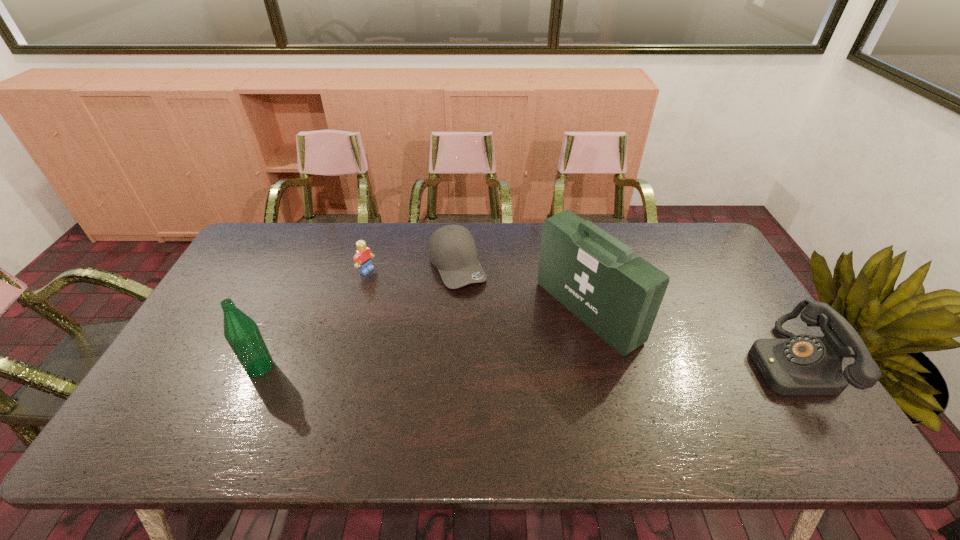
Locate an element on the screen. The height and width of the screenshot is (540, 960). bottle is located at coordinates [241, 332].

Where is `the fourth shortest object`? the fourth shortest object is located at coordinates (241, 332).

In order to click on the rightmost object in this screenshot , I will do `click(804, 364)`.

Locate an element on the screen. This screenshot has width=960, height=540. the third tallest object is located at coordinates (804, 364).

Where is `the first-aid kit`? The image size is (960, 540). the first-aid kit is located at coordinates (595, 276).

The image size is (960, 540). Find the location of `the third object from left to right`. the third object from left to right is located at coordinates (452, 249).

This screenshot has width=960, height=540. What are the coordinates of `Lego` in the screenshot? It's located at click(362, 258).

This screenshot has width=960, height=540. I want to click on blank space located 0.220m on the right of the fourth shortest object, so click(358, 367).

This screenshot has height=540, width=960. Find the location of `vacant point located on the dial of the third shortest object`. vacant point located on the dial of the third shortest object is located at coordinates (666, 363).

Identify the location of vacant space located 0.290m on the dial of the third shortest object. The height and width of the screenshot is (540, 960). (643, 363).